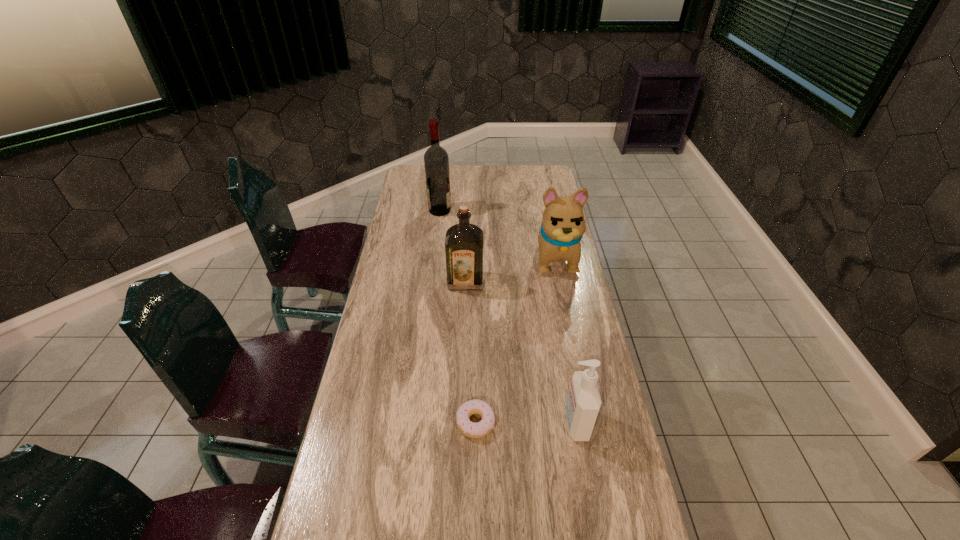
This screenshot has width=960, height=540. What are the coordinates of `free space that satisfies the following two spatial constraints: 1. on the face of the puppy; 2. on the front label of the cleansing agent` in the screenshot? It's located at point(588,423).

Find the location of a particular element. This screenshot has height=540, width=960. free location that satisfies the following two spatial constraints: 1. on the front and back of the leftmost object; 2. on the left side of the doughnut is located at coordinates (415, 422).

Where is `vacant point that satisfies the following two spatial constraints: 1. on the face of the puppy; 2. on the front label of the cleansing agent`? This screenshot has width=960, height=540. vacant point that satisfies the following two spatial constraints: 1. on the face of the puppy; 2. on the front label of the cleansing agent is located at coordinates tap(588, 423).

In order to click on free space that satisfies the following two spatial constraints: 1. on the face of the puppy; 2. on the front label of the cleansing agent in this screenshot , I will do `click(588, 423)`.